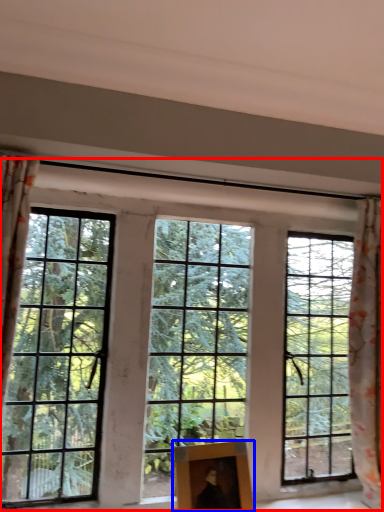
Question: Which object is further to the camera taking this photo, window (highlighted by a red box) or picture frame (highlighted by a blue box)?

Choices:
 (A) window
 (B) picture frame

Answer: (A)